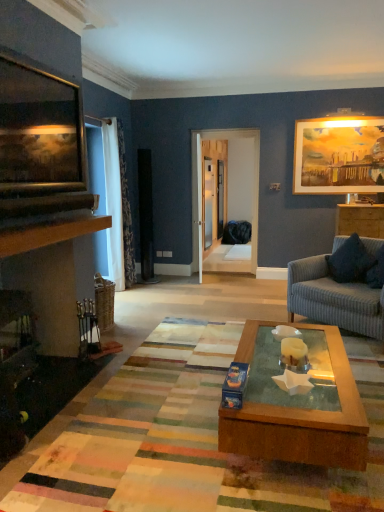
Question: From the image's perspective, is white floral fabric curtain at left positioned above or below wooden cabinet at right?

Choices:
 (A) below
 (B) above

Answer: (B)

Question: Is white floral fabric curtain at left bigger or smaller than wooden cabinet at right?

Choices:
 (A) small
 (B) big

Answer: (B)

Question: Which of these objects is positioned closest to the dark blue textured pillow at right?

Choices:
 (A) striped fabric couch at right
 (B) matte wooden picture frame at upper right, marked as the first picture frame in a back-to-front arrangement
 (C) wooden picture frame at upper left, the 2th picture frame when ordered from back to front
 (D) wooden cabinet at right
 (E) multicolored woven mat at center

Answer: (A)

Question: Which object is the farthest from the wooden picture frame at upper left, the first picture frame in the front-to-back sequence?

Choices:
 (A) dark blue textured pillow at right
 (B) matte wooden picture frame at upper right, the 2th picture frame from the left
 (C) white floral fabric curtain at left
 (D) striped fabric couch at right
 (E) multicolored woven mat at center

Answer: (B)